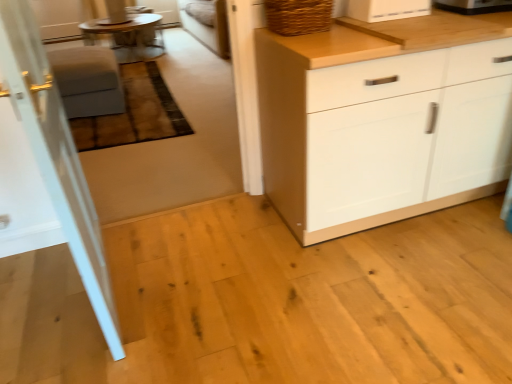
Find the location of a particular element. free area in between white matte cabinet at center and white glossy door at left is located at coordinates (234, 257).